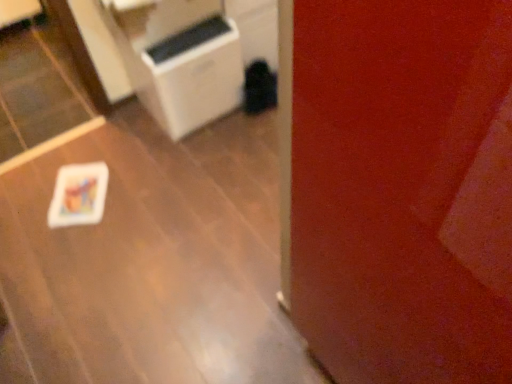
Question: Is white plastic air purifier at center facing away from white glossy table at lower left?

Choices:
 (A) yes
 (B) no

Answer: (B)

Question: Is white plastic air purifier at center behind white glossy table at lower left?

Choices:
 (A) no
 (B) yes

Answer: (B)

Question: Is white plastic air purifier at center aimed at white glossy table at lower left?

Choices:
 (A) yes
 (B) no

Answer: (B)

Question: Is white plastic air purifier at center at the left side of white glossy table at lower left?

Choices:
 (A) yes
 (B) no

Answer: (B)

Question: From the image's perspective, is white plastic air purifier at center under white glossy table at lower left?

Choices:
 (A) yes
 (B) no

Answer: (B)

Question: Is white glossy table at lower left located within white plastic air purifier at center?

Choices:
 (A) no
 (B) yes

Answer: (A)

Question: Considering the relative positions of white glossy table at lower left and white plastic air purifier at center in the image provided, is white glossy table at lower left behind white plastic air purifier at center?

Choices:
 (A) no
 (B) yes

Answer: (A)

Question: Considering the relative sizes of white glossy table at lower left and white plastic air purifier at center in the image provided, is white glossy table at lower left smaller than white plastic air purifier at center?

Choices:
 (A) no
 (B) yes

Answer: (B)

Question: Considering the relative sizes of white glossy table at lower left and white plastic air purifier at center in the image provided, is white glossy table at lower left shorter than white plastic air purifier at center?

Choices:
 (A) yes
 (B) no

Answer: (A)

Question: Is white glossy table at lower left in front of white plastic air purifier at center?

Choices:
 (A) yes
 (B) no

Answer: (A)

Question: Considering the relative positions of white glossy table at lower left and white plastic air purifier at center in the image provided, is white glossy table at lower left to the left of white plastic air purifier at center from the viewer's perspective?

Choices:
 (A) no
 (B) yes

Answer: (B)

Question: Can you confirm if white glossy table at lower left is thinner than white plastic air purifier at center?

Choices:
 (A) yes
 (B) no

Answer: (B)

Question: Considering the positions of white plastic air purifier at center and white glossy table at lower left in the image, is white plastic air purifier at center bigger or smaller than white glossy table at lower left?

Choices:
 (A) big
 (B) small

Answer: (A)